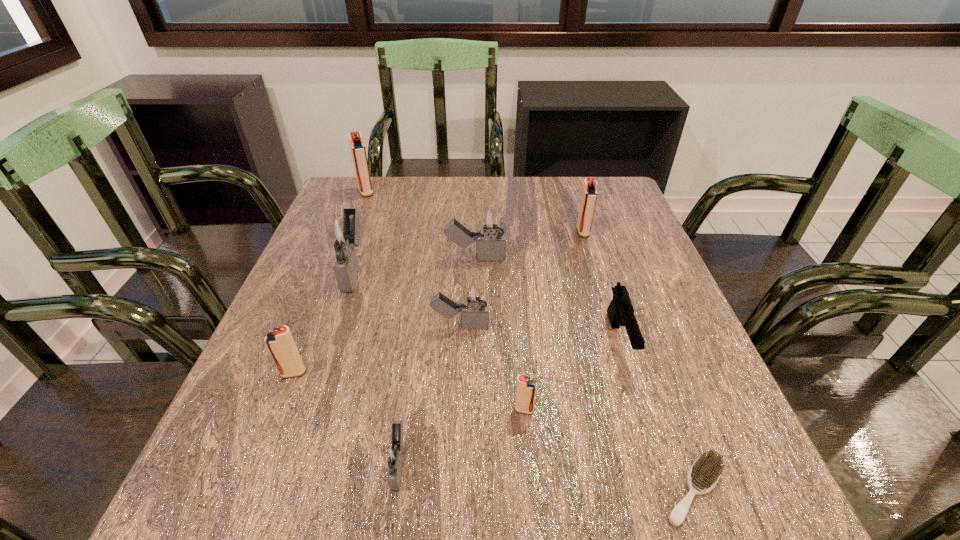
The height and width of the screenshot is (540, 960). I want to click on pistol that is at the right edge, so click(x=620, y=311).

Locate an element on the screen. The width and height of the screenshot is (960, 540). scrubbing brush located in the right edge section of the desktop is located at coordinates click(x=705, y=472).

The image size is (960, 540). What are the coordinates of `object positioned at the far left corner` in the screenshot? It's located at coord(358,150).

At what (x,y) coordinates should I click in order to perform the action: click on object positioned at the near right corner. Please return your answer as a coordinate pair (x, y). Looking at the image, I should click on (705, 472).

Locate an element on the screen. The image size is (960, 540). vacant space at the far edge of the desktop is located at coordinates (513, 179).

Identify the location of free location at the near edge. (324, 480).

The image size is (960, 540). In the image, there is a desktop. Identify the location of vacant space at the left edge. (317, 294).

Locate an element on the screen. This screenshot has height=540, width=960. vacant space at the right edge of the desktop is located at coordinates (646, 354).

The height and width of the screenshot is (540, 960). In the image, there is a desktop. In order to click on vacant space at the far right corner in this screenshot , I will do `click(636, 212)`.

Locate an element on the screen. This screenshot has height=540, width=960. free space between the third biggest gray igniter and the third biggest red igniter is located at coordinates (377, 349).